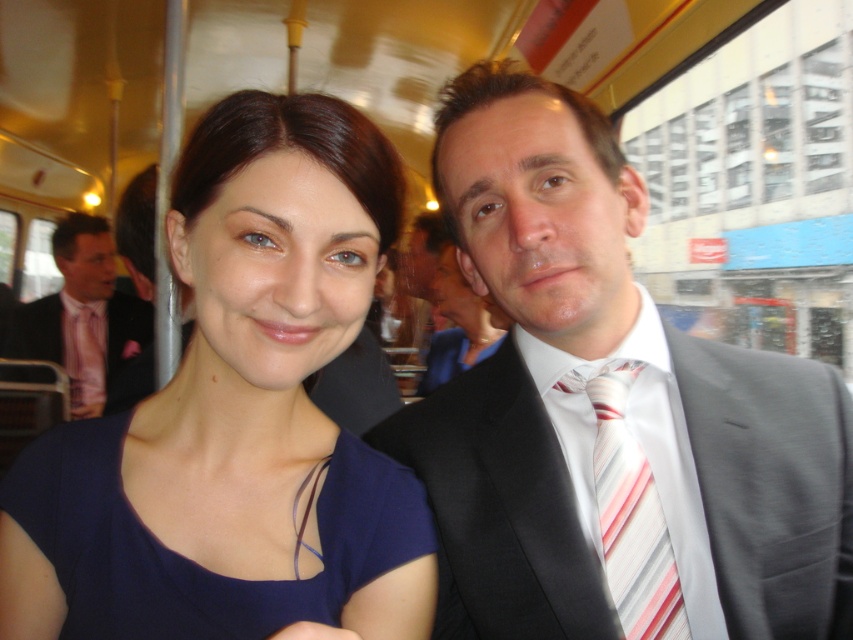
Question: Which point appears farthest from the camera in this image?

Choices:
 (A) (653, 500)
 (B) (381, 136)
 (C) (483, 339)

Answer: (C)

Question: Which point is closer to the camera?

Choices:
 (A) (412, 636)
 (B) (68, 224)
 (C) (100, 572)

Answer: (C)

Question: Is striped silk tie at right behind pink striped tie at left?

Choices:
 (A) no
 (B) yes

Answer: (A)

Question: Does pink striped tie at left appear over matte black suit at center?

Choices:
 (A) no
 (B) yes

Answer: (B)

Question: Which point is farther to the camera?

Choices:
 (A) (450, 545)
 (B) (421, 502)
 (C) (419, 394)
 (D) (285, 266)

Answer: (C)

Question: Can you confirm if navy blue fabric dress at center is positioned below matte black suit at center?

Choices:
 (A) no
 (B) yes

Answer: (B)